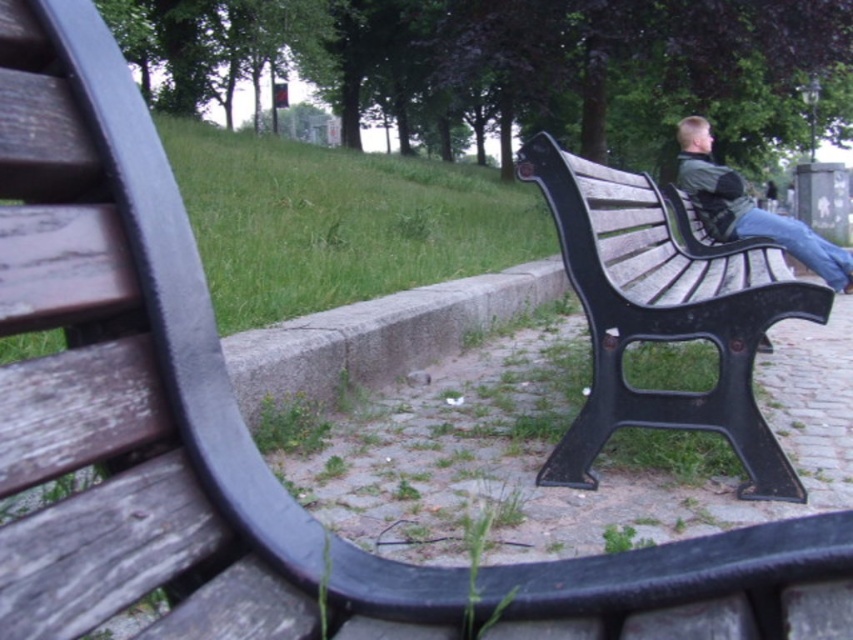
Does point (587, 458) come in front of point (734, 224)?

Yes, point (587, 458) is closer to viewer.

Measure the distance between point (634, 301) and camera.

Point (634, 301) is 1.34 meters from camera.

Image resolution: width=853 pixels, height=640 pixels. I want to click on wooden bench at right, so click(663, 316).